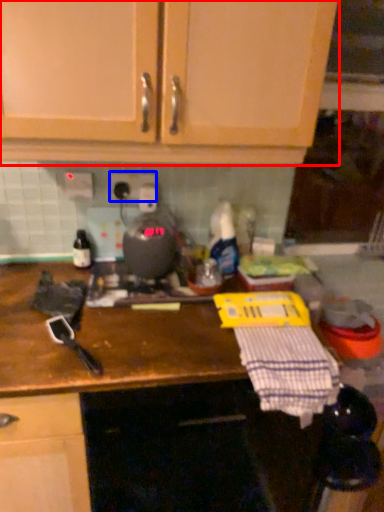
Question: Which of the following is the farthest to the observer, cabinetry (highlighted by a red box) or electric outlet (highlighted by a blue box)?

Choices:
 (A) cabinetry
 (B) electric outlet

Answer: (B)